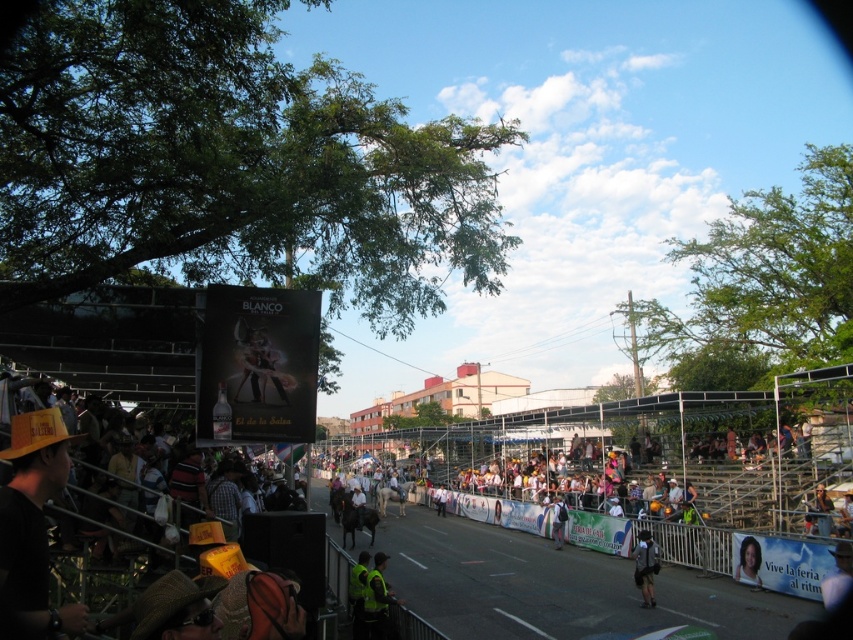
Does dark gray backpack at lower center have a greater width compared to smooth skin portrait at center?

Correct, the width of dark gray backpack at lower center exceeds that of smooth skin portrait at center.

In the scene shown: Between dark gray backpack at lower center and smooth skin portrait at center, which one is positioned lower?

Positioned lower is dark gray backpack at lower center.

Where is `dark gray backpack at lower center`? Image resolution: width=853 pixels, height=640 pixels. dark gray backpack at lower center is located at coordinates (645, 566).

Which is above, dark gray backpack at lower center or white fabric shirt at center?

dark gray backpack at lower center is higher up.

Who is more distant from viewer, (646,572) or (444,508)?

Positioned behind is point (444,508).

Locate an element on the screen. Image resolution: width=853 pixels, height=640 pixels. dark gray backpack at lower center is located at coordinates (645, 566).

Which is more to the right, dark gray backpack at lower center or dark blue backpack at center?

dark gray backpack at lower center

Based on the photo, does dark gray backpack at lower center have a smaller size compared to dark blue backpack at center?

No.

Between point (637, 550) and point (560, 512), which one is positioned in front?

Point (637, 550) is in front.

This screenshot has width=853, height=640. I want to click on dark gray backpack at lower center, so click(x=645, y=566).